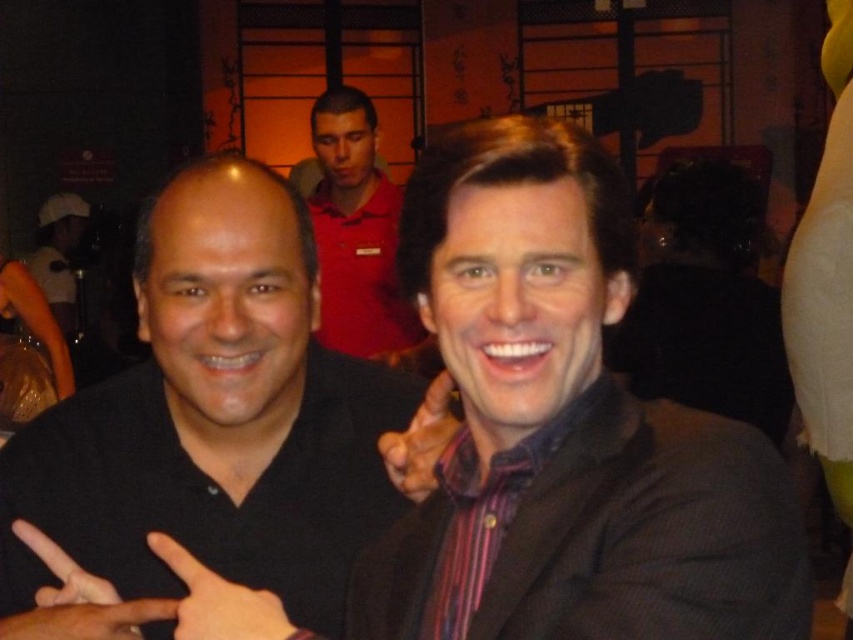
Does point (239, 637) lie behind point (445, 381)?

No, it is not.

Can you confirm if smooth skin finger at center is wider than matte black hand at center?

Yes.

The image size is (853, 640). What do you see at coordinates (218, 600) in the screenshot? I see `smooth skin finger at center` at bounding box center [218, 600].

In order to click on smooth skin finger at center in this screenshot , I will do `click(218, 600)`.

What do you see at coordinates (354, 228) in the screenshot? This screenshot has height=640, width=853. I see `matte red polo shirt at center` at bounding box center [354, 228].

Who is lower down, matte red polo shirt at center or striped cotton shirt at center?

Positioned lower is striped cotton shirt at center.

Who is more forward, (312, 136) or (548, 451)?

Point (548, 451) is more forward.

Locate an element on the screen. This screenshot has width=853, height=640. matte red polo shirt at center is located at coordinates (354, 228).

Which is more to the left, black shirt at left or smooth skin finger at center?

From the viewer's perspective, smooth skin finger at center appears more on the left side.

What do you see at coordinates (566, 428) in the screenshot? I see `black shirt at left` at bounding box center [566, 428].

The image size is (853, 640). Describe the element at coordinates (566, 428) in the screenshot. I see `black shirt at left` at that location.

Locate an element on the screen. The width and height of the screenshot is (853, 640). black shirt at left is located at coordinates (566, 428).